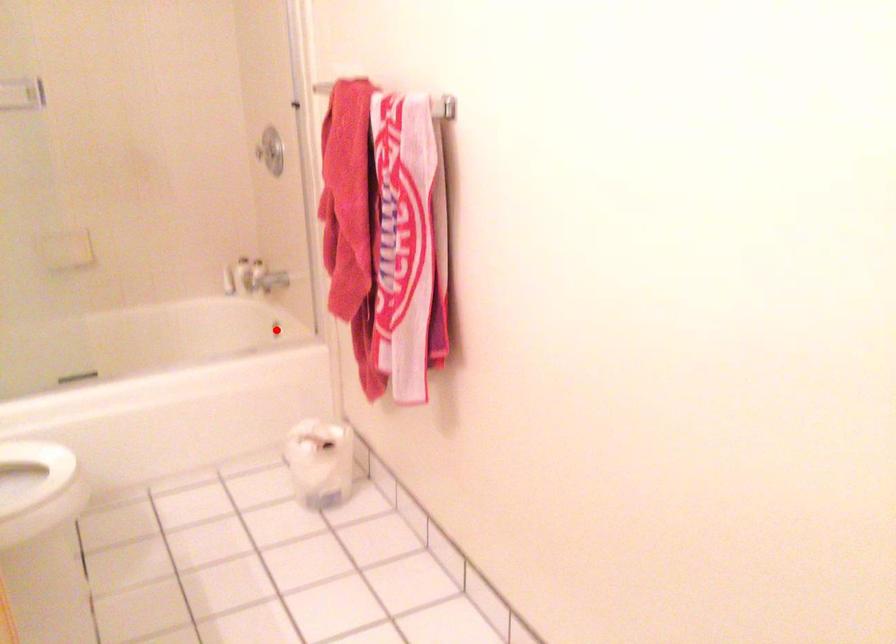
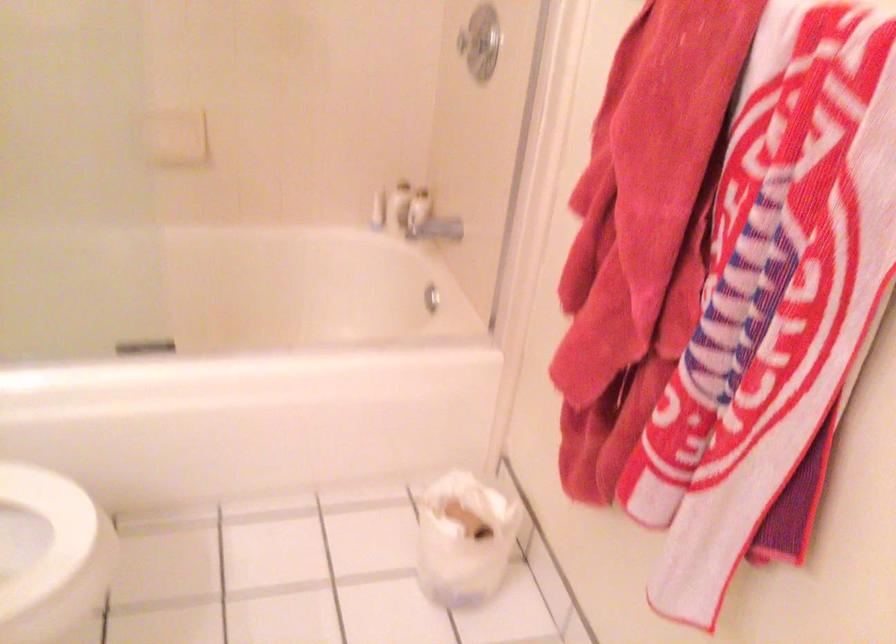
In the second image, find the point that corresponds to the highlighted location in the first image.

(431, 298)